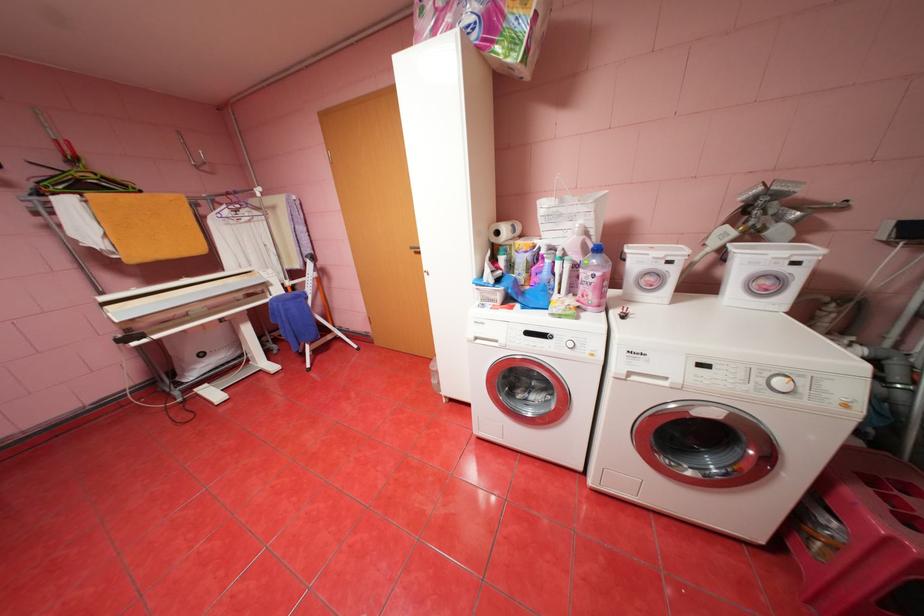
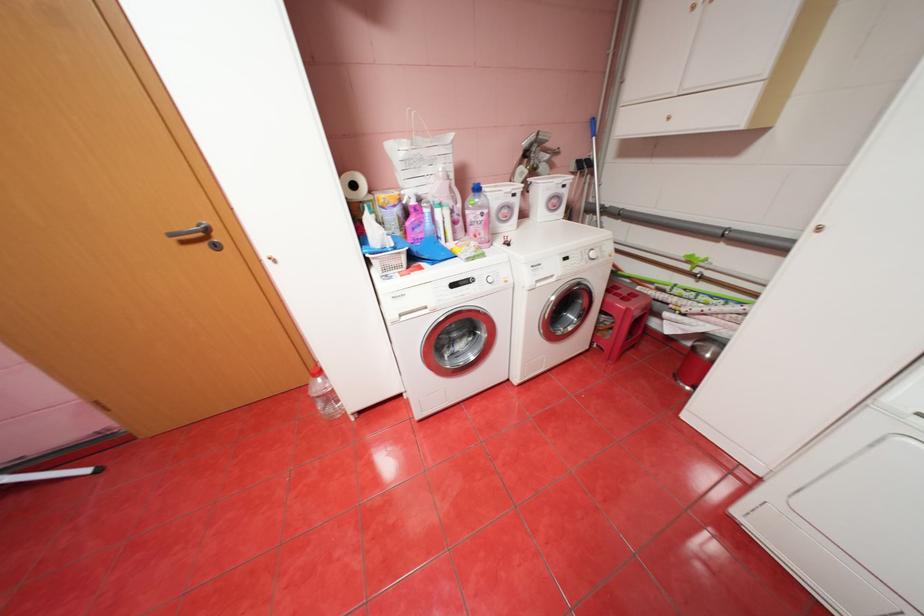
In the second image, find the point that corresponds to point (564, 209) in the first image.

(423, 151)